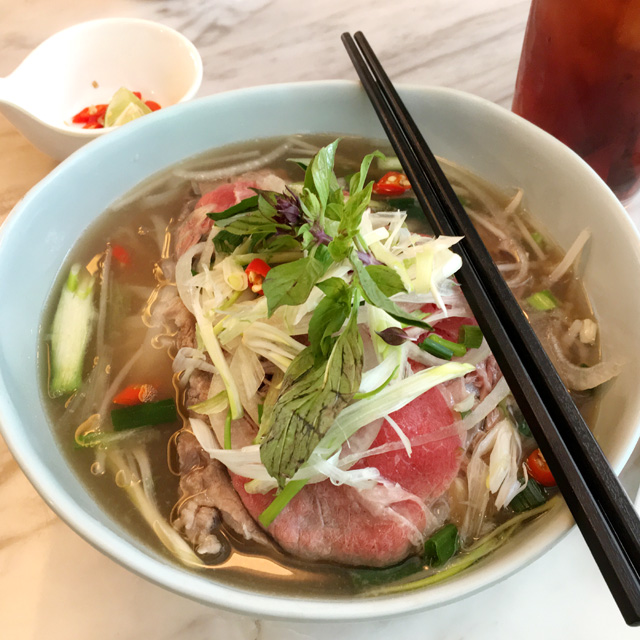
Locate an element on the screen. This screenshot has height=640, width=640. bottom bowl edge is located at coordinates (337, 612).